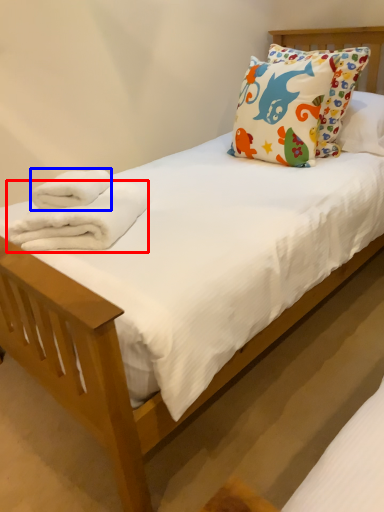
Question: Which object appears farthest to the camera in this image, bath towel (highlighted by a red box) or bath towel (highlighted by a blue box)?

Choices:
 (A) bath towel
 (B) bath towel

Answer: (B)